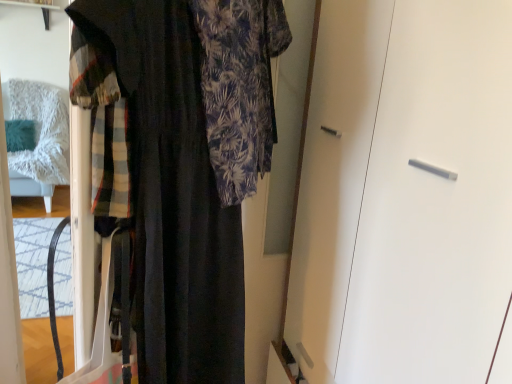
Question: Should I look upward or downward to see white matte cabinet at center?

Choices:
 (A) down
 (B) up

Answer: (A)

Question: Does dark blue textured dress at left touch white matte cabinet at center?

Choices:
 (A) no
 (B) yes

Answer: (A)

Question: Could you tell me if dark blue textured dress at left is facing white matte cabinet at center?

Choices:
 (A) no
 (B) yes

Answer: (B)

Question: Is dark blue textured dress at left further to camera compared to white matte cabinet at center?

Choices:
 (A) no
 (B) yes

Answer: (A)

Question: Is there a large distance between dark blue textured dress at left and white matte cabinet at center?

Choices:
 (A) no
 (B) yes

Answer: (A)

Question: Does dark blue textured dress at left contain white matte cabinet at center?

Choices:
 (A) yes
 (B) no

Answer: (B)

Question: Is dark blue textured dress at left outside white matte cabinet at center?

Choices:
 (A) yes
 (B) no

Answer: (A)

Question: Considering the relative sizes of white matte cabinet at center and dark blue textured dress at left in the image provided, is white matte cabinet at center shorter than dark blue textured dress at left?

Choices:
 (A) no
 (B) yes

Answer: (A)

Question: From the image's perspective, is white matte cabinet at center on dark blue textured dress at left?

Choices:
 (A) yes
 (B) no

Answer: (B)

Question: Are white matte cabinet at center and dark blue textured dress at left beside each other?

Choices:
 (A) yes
 (B) no

Answer: (B)

Question: Is dark blue textured dress at left surrounded by white matte cabinet at center?

Choices:
 (A) yes
 (B) no

Answer: (B)

Question: Considering the relative sizes of white matte cabinet at center and dark blue textured dress at left in the image provided, is white matte cabinet at center thinner than dark blue textured dress at left?

Choices:
 (A) no
 (B) yes

Answer: (A)

Question: From a real-world perspective, is white matte cabinet at center on top of dark blue textured dress at left?

Choices:
 (A) yes
 (B) no

Answer: (B)

Question: Is white matte cabinet at center wider or thinner than dark blue textured dress at left?

Choices:
 (A) thin
 (B) wide

Answer: (B)